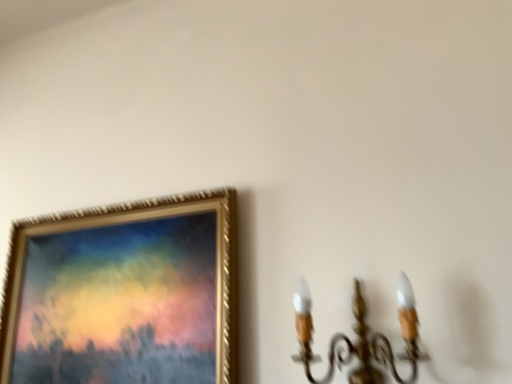
The image size is (512, 384). I want to click on gold textured frame at upper left, so click(x=123, y=294).

The image size is (512, 384). What do you see at coordinates (123, 294) in the screenshot?
I see `gold textured frame at upper left` at bounding box center [123, 294].

Measure the distance between point (x=67, y=246) and camera.

A distance of 1.34 meters exists between point (x=67, y=246) and camera.

The height and width of the screenshot is (384, 512). In order to click on gold metallic chandelier at right in this screenshot , I will do `click(360, 339)`.

This screenshot has width=512, height=384. What do you see at coordinates (360, 339) in the screenshot?
I see `gold metallic chandelier at right` at bounding box center [360, 339].

Image resolution: width=512 pixels, height=384 pixels. I want to click on gold textured frame at upper left, so click(x=123, y=294).

In the scene shown: Which is more to the right, gold textured frame at upper left or gold metallic chandelier at right?

From the viewer's perspective, gold metallic chandelier at right appears more on the right side.

In the image, is gold textured frame at upper left positioned in front of or behind gold metallic chandelier at right?

gold textured frame at upper left is behind gold metallic chandelier at right.

Considering the points (165, 202) and (359, 311), which point is in front, point (165, 202) or point (359, 311)?

The point (359, 311) is in front.

From the image's perspective, is gold textured frame at upper left under gold metallic chandelier at right?

Correct, gold textured frame at upper left appears lower than gold metallic chandelier at right in the image.

From a real-world perspective, which is physically below, gold textured frame at upper left or gold metallic chandelier at right?

gold metallic chandelier at right, from a real-world perspective.

Looking at their sizes, would you say gold textured frame at upper left is wider or thinner than gold metallic chandelier at right?

Clearly, gold textured frame at upper left has less width compared to gold metallic chandelier at right.

Looking at this image, who is shorter, gold textured frame at upper left or gold metallic chandelier at right?

Standing shorter between the two is gold metallic chandelier at right.

Considering the relative sizes of gold textured frame at upper left and gold metallic chandelier at right in the image provided, is gold textured frame at upper left bigger than gold metallic chandelier at right?

Indeed, gold textured frame at upper left has a larger size compared to gold metallic chandelier at right.

Would you say gold metallic chandelier at right is part of gold textured frame at upper left's contents?

No, gold metallic chandelier at right is not inside gold textured frame at upper left.

Can you see gold textured frame at upper left touching gold metallic chandelier at right?

No, gold textured frame at upper left is not making contact with gold metallic chandelier at right.

Looking at this image, is gold textured frame at upper left turned away from gold metallic chandelier at right?

No, gold textured frame at upper left is not facing the opposite direction of gold metallic chandelier at right.

The width and height of the screenshot is (512, 384). In the image, there is a gold textured frame at upper left. Find the location of `lamp above it (from the image's perspective)`. lamp above it (from the image's perspective) is located at coordinates (360, 339).

In the image, is gold metallic chandelier at right on the left side or the right side of gold textured frame at upper left?

From the image, it's evident that gold metallic chandelier at right is to the right of gold textured frame at upper left.

Which object is further away from the camera, gold metallic chandelier at right or gold textured frame at upper left?

gold textured frame at upper left is more distant.

Between point (361, 351) and point (168, 217), which one is positioned behind?

The point (168, 217) is farther from the camera.

From the image's perspective, is gold metallic chandelier at right located above or below gold textured frame at upper left?

Based on their image positions, gold metallic chandelier at right is located above gold textured frame at upper left.

From a real-world perspective, between gold metallic chandelier at right and gold textured frame at upper left, who is vertically lower?

From a 3D spatial view, gold metallic chandelier at right is below.

Does gold metallic chandelier at right have a lesser width compared to gold textured frame at upper left?

In fact, gold metallic chandelier at right might be wider than gold textured frame at upper left.

Who is taller, gold metallic chandelier at right or gold textured frame at upper left?

gold textured frame at upper left.

Looking at this image, in terms of size, does gold metallic chandelier at right appear bigger or smaller than gold textured frame at upper left?

Considering their sizes, gold metallic chandelier at right takes up less space than gold textured frame at upper left.

Is gold textured frame at upper left inside gold metallic chandelier at right?

No, gold textured frame at upper left is located outside of gold metallic chandelier at right.

Looking at this image, is gold metallic chandelier at right beside gold textured frame at upper left?

gold metallic chandelier at right and gold textured frame at upper left are not in contact.

Does gold metallic chandelier at right turn towards gold textured frame at upper left?

No, gold metallic chandelier at right is not turned towards gold textured frame at upper left.

Can you tell me how much gold metallic chandelier at right and gold textured frame at upper left differ in facing direction?

0.435 degrees separate the facing orientations of gold metallic chandelier at right and gold textured frame at upper left.

How far apart are gold metallic chandelier at right and gold textured frame at upper left?

They are 47.99 centimeters apart.

Where is `lamp on the right of gold textured frame at upper left`? lamp on the right of gold textured frame at upper left is located at coordinates (360, 339).

The image size is (512, 384). I want to click on lamp that appears below the gold textured frame at upper left (from a real-world perspective), so click(x=360, y=339).

You are a GUI agent. You are given a task and a screenshot of the screen. Output one action in this format:
    pyautogui.click(x=<x>, y=<y>)
    Task: Click on the lamp that is in front of the gold textured frame at upper left
    
    Given the screenshot: What is the action you would take?
    pyautogui.click(x=360, y=339)